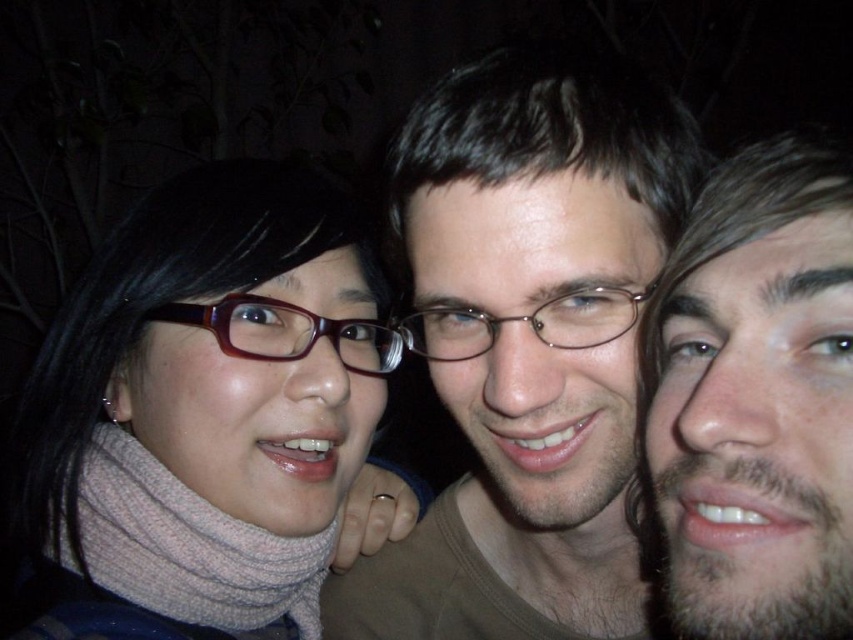
You are a photographer trying to adjust the lighting for a portrait. You notice the beige facial hair at right and the matte brown glasses at left in the frame. Based on their positions, which object is closer to the camera?

The beige facial hair at right is closer to the camera because it is in front of the matte brown glasses at left.

You are a photographer adjusting the lighting for a night portrait. You notice two elements in the frame that might cast shadows on the subjects. The beige facial hair at right and the matte plastic glasses at center. Which of these elements is closer to the camera, potentially causing more prominent shadows?

The beige facial hair at right is in front of the matte plastic glasses at center, so it is closer to the camera and would cast more prominent shadows.

From the picture: In the nighttime photo of three people standing together, there is a point at coordinates (756, 401). Which person does this point belong to?

The point at (756, 401) is on the beige facial hair at right, so it belongs to the person on the right.